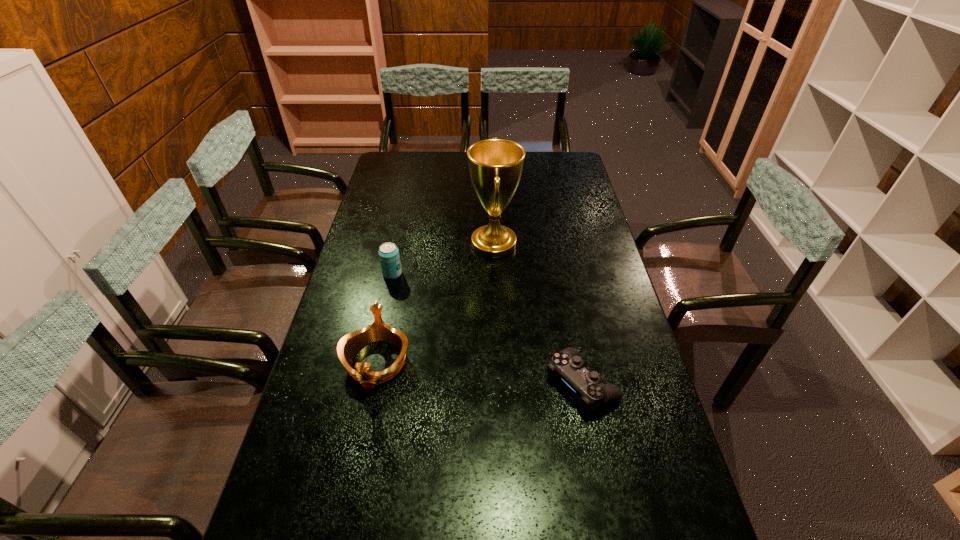
You are a GUI agent. You are given a task and a screenshot of the screen. Output one action in this format:
    pyautogui.click(x=<x>, y=<y>)
    Task: Click on the second object from right to left
    This screenshot has height=540, width=960.
    Given the screenshot: What is the action you would take?
    pyautogui.click(x=495, y=165)

What are the coordinates of `award` in the screenshot? It's located at (495, 165).

This screenshot has width=960, height=540. Identify the location of tiara. (350, 344).

Find the location of a particular element. This screenshot has height=540, width=960. beer can is located at coordinates (389, 256).

At what (x,y) coordinates should I click in order to perform the action: click on control. Please return your answer as a coordinate pair (x, y). The image size is (960, 540). Looking at the image, I should click on (567, 365).

Image resolution: width=960 pixels, height=540 pixels. I want to click on the shortest object, so 567,365.

Find the location of a particular element. This screenshot has width=960, height=540. free point located 0.280m by the handles of the award is located at coordinates (394, 244).

Where is `free point located by the handles of the award`? The image size is (960, 540). free point located by the handles of the award is located at coordinates coord(407,244).

The image size is (960, 540). I want to click on free space located 0.210m by the handles of the award, so click(412, 244).

Locate an element on the screen. The height and width of the screenshot is (540, 960). free spot located at the front emblem of the tiara is located at coordinates (354, 467).